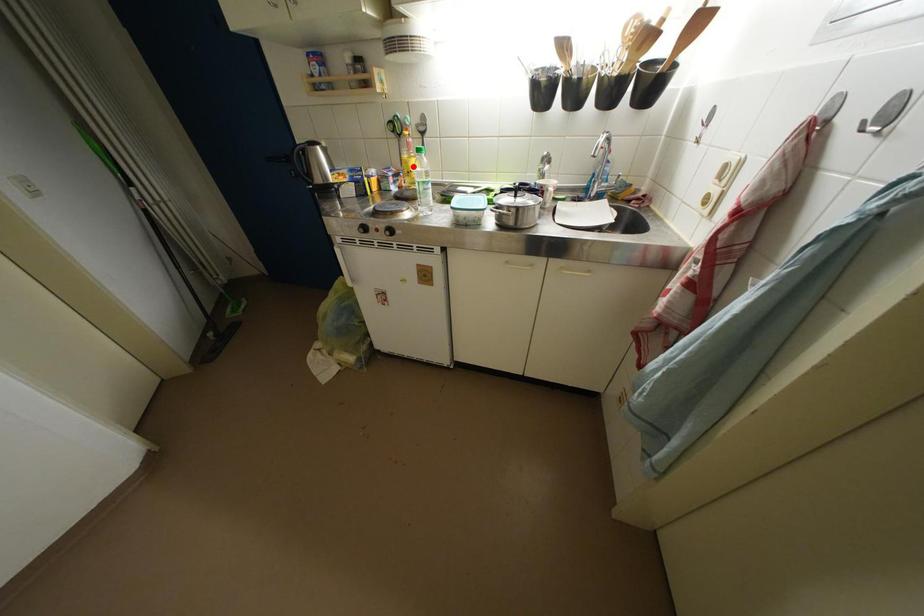
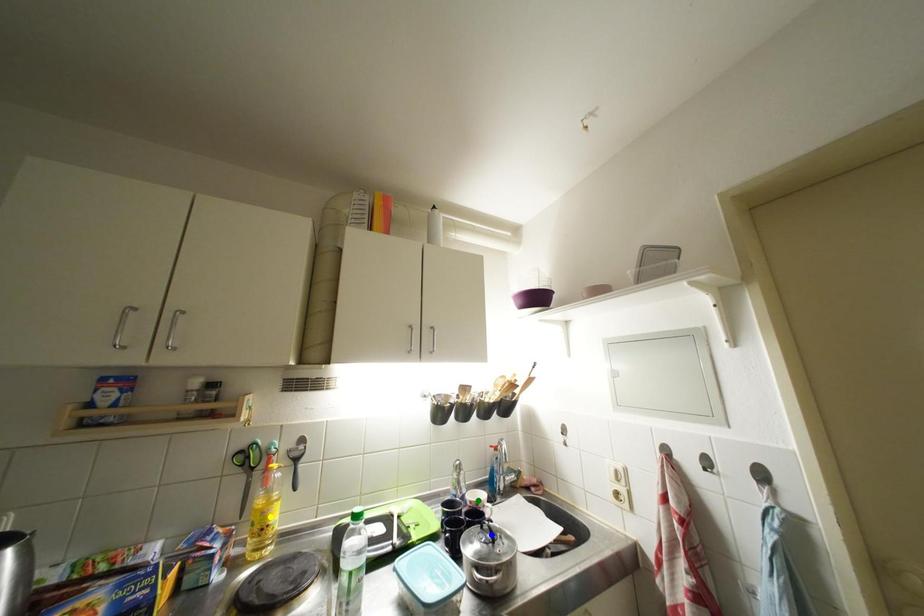
Question: I am providing you with two images of the same scene from different viewpoints. A red point is marked on the first image. You are given multiple points on the second image. Which point in image 2 represents the same 3d spot as the red point in image 1?

Choices:
 (A) green point
 (B) yellow point
 (C) blue point

Answer: (B)